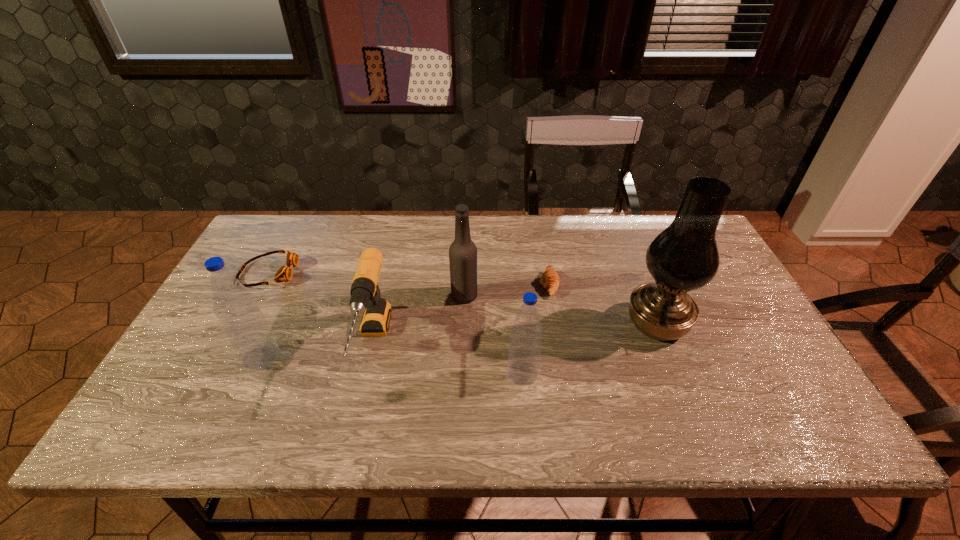
Identify the location of vacant area that lies between the beer bottle and the pastry. The height and width of the screenshot is (540, 960). (507, 290).

Where is `free space between the shorter water bottle and the goggles`? free space between the shorter water bottle and the goggles is located at coordinates (396, 323).

Find the location of a particular element. vacant area that lies between the goggles and the drill is located at coordinates (320, 308).

Locate an element on the screen. vacant region between the drill and the left water bottle is located at coordinates [x=317, y=350].

Select which object appears as the third closest to the left water bottle. Please provide its 2D coordinates. Your answer should be formatted as a tuple, i.e. [(x, y)], where the tuple contains the x and y coordinates of a point satisfying the conditions above.

[(463, 252)]

Point out which object is positioned as the nearest to the goggles. Please provide its 2D coordinates. Your answer should be formatted as a tuple, i.e. [(x, y)], where the tuple contains the x and y coordinates of a point satisfying the conditions above.

[(245, 326)]

Image resolution: width=960 pixels, height=540 pixels. In order to click on free space that satisfies the following two spatial constraints: 1. on the back side of the third object from right to left; 2. with the lenses facing forward on the goggles in this screenshot , I will do 514,273.

The width and height of the screenshot is (960, 540). In order to click on free space in the image that satisfies the following two spatial constraints: 1. on the handle side of the shorter water bottle; 2. on the left side of the fifth object from right to left in this screenshot , I will do `click(366, 373)`.

The height and width of the screenshot is (540, 960). I want to click on vacant position in the image that satisfies the following two spatial constraints: 1. on the label of the fourth object from right to left; 2. on the back side of the shorter water bottle, so click(x=462, y=373).